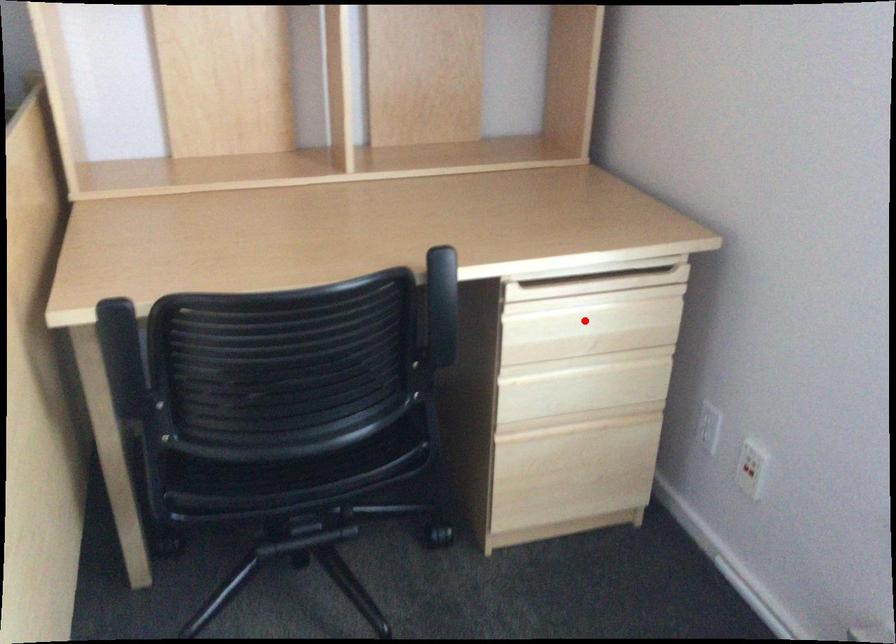
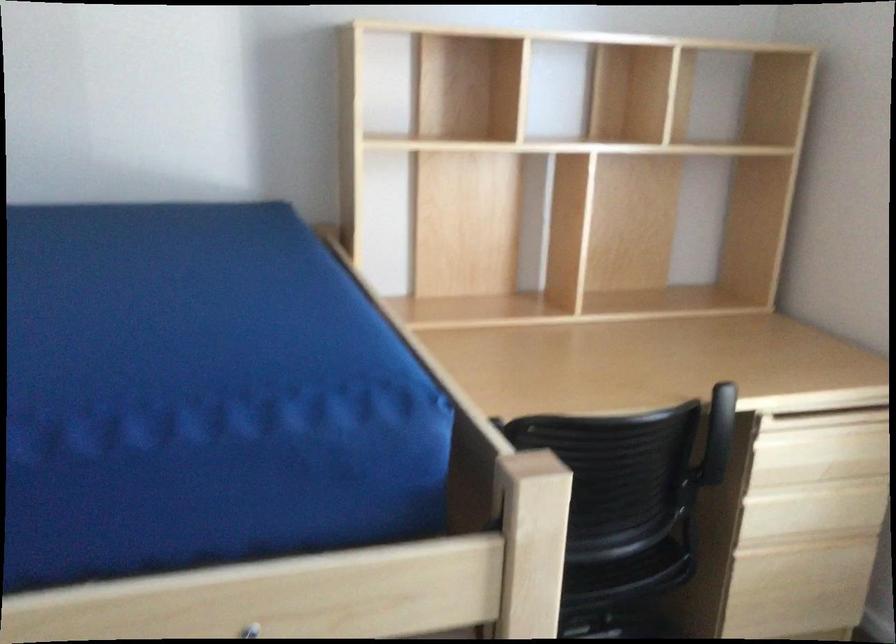
Question: I am providing you with two images of the same scene from different viewpoints. Given a red point in image1, look at the same physical point in image2. Is it:

Choices:
 (A) Closer to the viewpoint
 (B) Farther from the viewpoint

Answer: (B)